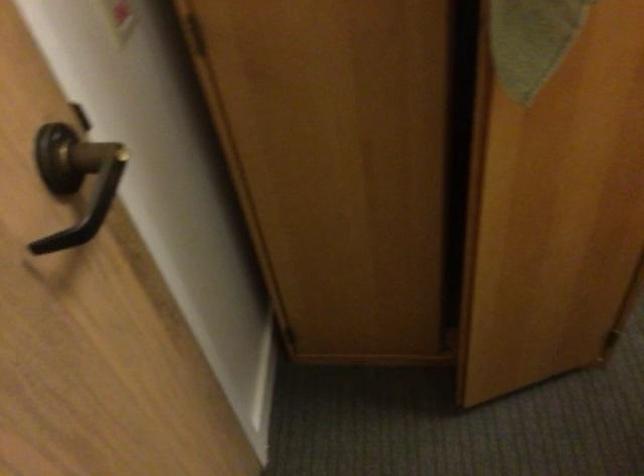
First-person continuous shooting, in which direction is the camera rotating?

The rotation direction of the camera is left-down.